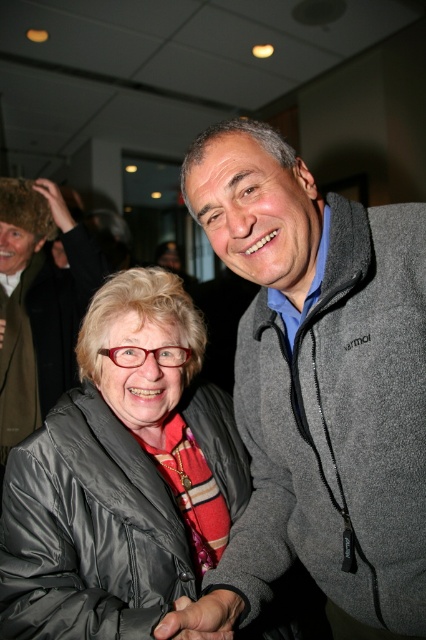
Between matte black jacket at center and gray fleece jacket at upper right, which one appears on the right side from the viewer's perspective?

From the viewer's perspective, matte black jacket at center appears more on the right side.

Identify the location of matte black jacket at center. (121, 476).

The height and width of the screenshot is (640, 426). What do you see at coordinates (121, 476) in the screenshot?
I see `matte black jacket at center` at bounding box center [121, 476].

This screenshot has height=640, width=426. In order to click on matte black jacket at center in this screenshot , I will do click(x=121, y=476).

Can you confirm if gray fleece jacket at right is shorter than matte black jacket at center?

Incorrect, gray fleece jacket at right's height does not fall short of matte black jacket at center's.

In the scene shown: Which of these two, gray fleece jacket at right or matte black jacket at center, stands taller?

Standing taller between the two is gray fleece jacket at right.

The width and height of the screenshot is (426, 640). What do you see at coordinates (317, 385) in the screenshot?
I see `gray fleece jacket at right` at bounding box center [317, 385].

Identify the location of gray fleece jacket at right. pyautogui.click(x=317, y=385).

Between gray fleece jacket at right and gray fleece jacket at upper right, which one is positioned lower?

gray fleece jacket at right is lower down.

This screenshot has height=640, width=426. Identify the location of gray fleece jacket at right. (317, 385).

At what (x,y) coordinates should I click in order to perform the action: click on gray fleece jacket at right. Please return your answer as a coordinate pair (x, y). The image size is (426, 640). Looking at the image, I should click on (317, 385).